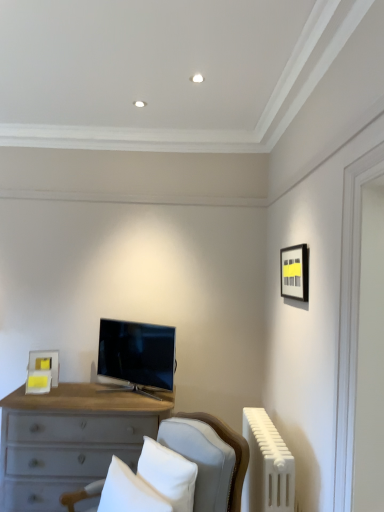
Question: Considering the relative sizes of matte black picture frame at upper right, the second picture frame positioned from the back, and satin black tv at center in the image provided, is matte black picture frame at upper right, the second picture frame positioned from the back, taller than satin black tv at center?

Choices:
 (A) yes
 (B) no

Answer: (B)

Question: Does matte black picture frame at upper right, arranged as the 2th picture frame when viewed from the left, have a larger size compared to satin black tv at center?

Choices:
 (A) yes
 (B) no

Answer: (B)

Question: Is matte black picture frame at upper right, which is counted as the second picture frame, starting from the bottom, looking in the opposite direction of satin black tv at center?

Choices:
 (A) no
 (B) yes

Answer: (A)

Question: Considering the relative positions of matte black picture frame at upper right, arranged as the 2th picture frame when viewed from the left, and satin black tv at center in the image provided, is matte black picture frame at upper right, arranged as the 2th picture frame when viewed from the left, to the right of satin black tv at center from the viewer's perspective?

Choices:
 (A) yes
 (B) no

Answer: (A)

Question: Are matte black picture frame at upper right, which is counted as the second picture frame, starting from the bottom, and satin black tv at center beside each other?

Choices:
 (A) no
 (B) yes

Answer: (A)

Question: Based on their positions, is light gray wood desk at center located to the left or right of matte black picture frame at upper right, the second picture frame positioned from the back?

Choices:
 (A) left
 (B) right

Answer: (A)

Question: Looking at the image, does light gray wood desk at center seem bigger or smaller compared to matte black picture frame at upper right, which appears as the first picture frame when viewed from the right?

Choices:
 (A) big
 (B) small

Answer: (A)

Question: Relative to matte black picture frame at upper right, the first picture frame when ordered from front to back, is light gray wood desk at center in front or behind?

Choices:
 (A) behind
 (B) front

Answer: (B)

Question: Considering the positions of light gray wood desk at center and matte black picture frame at upper right, the second picture frame positioned from the back, in the image, is light gray wood desk at center taller or shorter than matte black picture frame at upper right, the second picture frame positioned from the back,?

Choices:
 (A) short
 (B) tall

Answer: (B)

Question: Considering the positions of point (39, 366) and point (190, 493), is point (39, 366) closer or farther from the camera than point (190, 493)?

Choices:
 (A) closer
 (B) farther

Answer: (B)

Question: From the image's perspective, is matte yellow picture frame at center, the 1th picture frame viewed from the back, located above or below white fabric pillow at center, the first pillow positioned from the right?

Choices:
 (A) below
 (B) above

Answer: (B)

Question: Looking at their shapes, would you say matte yellow picture frame at center, the 1th picture frame viewed from the back, is wider or thinner than white fabric pillow at center, the second pillow in the left-to-right sequence?

Choices:
 (A) thin
 (B) wide

Answer: (A)

Question: In terms of size, does matte yellow picture frame at center, which is the first picture frame in bottom-to-top order, appear bigger or smaller than white fabric pillow at center, the second pillow in the left-to-right sequence?

Choices:
 (A) big
 (B) small

Answer: (B)

Question: Which is correct: matte yellow picture frame at center, which is the first picture frame in bottom-to-top order, is inside satin black tv at center, or outside of it?

Choices:
 (A) outside
 (B) inside

Answer: (A)

Question: Considering the positions of matte yellow picture frame at center, the 1th picture frame viewed from the back, and satin black tv at center in the image, is matte yellow picture frame at center, the 1th picture frame viewed from the back, wider or thinner than satin black tv at center?

Choices:
 (A) thin
 (B) wide

Answer: (A)